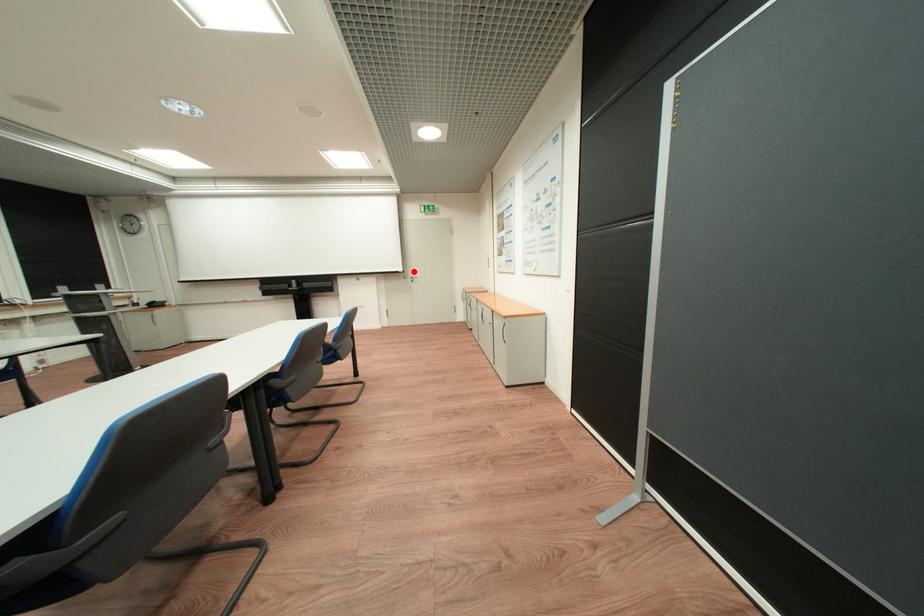
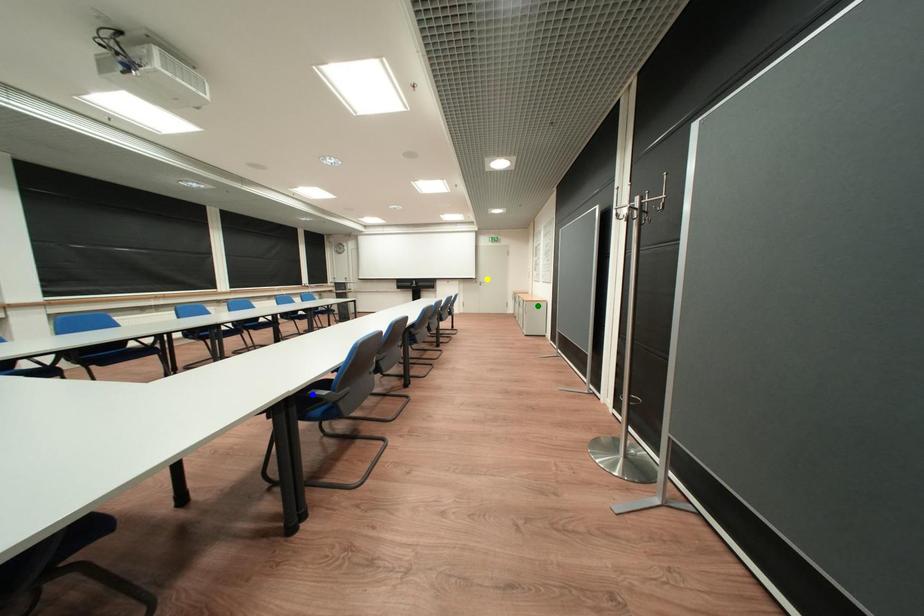
Question: I am providing you with two images of the same scene from different viewpoints. A red point is marked on the first image. You are given multiple points on the second image. In image 2, which mark is for the same physical point as the one in image 1?

Choices:
 (A) green point
 (B) blue point
 (C) yellow point

Answer: (C)